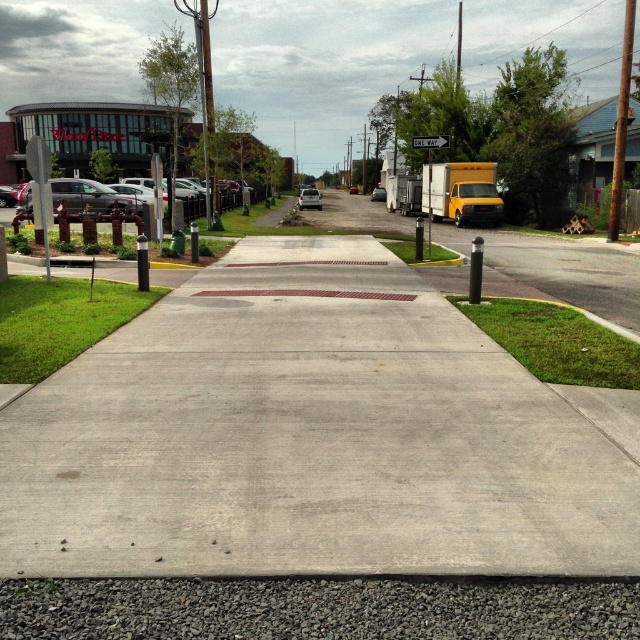
Can you confirm if gray concrete sidewalk at center is shorter than silver metallic sedan at center?

Yes.

Between gray concrete sidewalk at center and silver metallic sedan at center, which one appears on the right side from the viewer's perspective?

gray concrete sidewalk at center

Is point (627, 488) farther from viewer compared to point (305, 189)?

That is False.

Identify the location of gray concrete sidewalk at center. (314, 436).

Who is positioned more to the left, yellow matte truck at right or silver metallic sedan at center?

silver metallic sedan at center is more to the left.

Who is more distant from viewer, (438, 166) or (310, 188)?

Positioned behind is point (310, 188).

Is point (481, 196) farther from camera compared to point (305, 196)?

No, (481, 196) is closer to viewer.

The width and height of the screenshot is (640, 640). Find the location of `yellow matte truck at right`. yellow matte truck at right is located at coordinates (461, 193).

Does silver metallic sedan at center appear over matte white truck at center?

Incorrect, silver metallic sedan at center is not positioned above matte white truck at center.

Does point (316, 204) come closer to viewer compared to point (378, 186)?

Yes, it is in front of point (378, 186).

Measure the distance between silver metallic sedan at center and camera.

silver metallic sedan at center is 59.20 meters from camera.

The image size is (640, 640). I want to click on silver metallic sedan at center, so click(x=308, y=198).